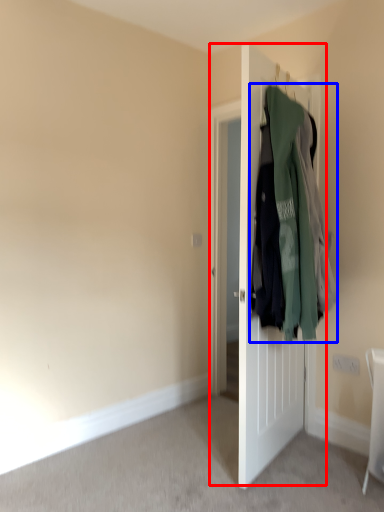
Question: Which of the following is the closest to the observer, door (highlighted by a red box) or laundry (highlighted by a blue box)?

Choices:
 (A) door
 (B) laundry

Answer: (B)